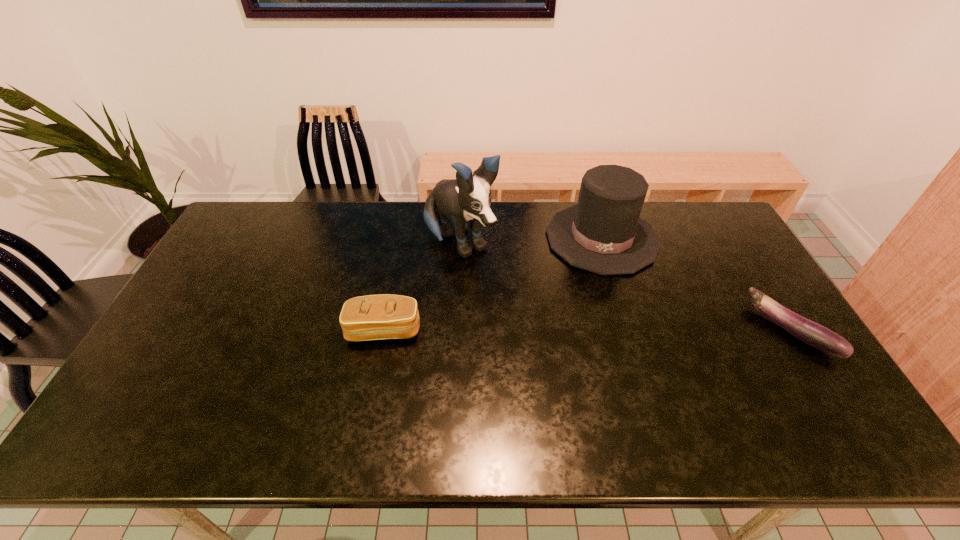
Locate an element on the screen. Image resolution: width=960 pixels, height=540 pixels. free space at the far left corner is located at coordinates (256, 234).

Identify the location of vacant space at the far right corner of the desktop. The width and height of the screenshot is (960, 540). (717, 236).

Where is `free area in between the shortest object and the third tallest object`? free area in between the shortest object and the third tallest object is located at coordinates (588, 330).

This screenshot has height=540, width=960. I want to click on free point between the clutch bag and the shortest object, so click(x=588, y=330).

Where is `free spot between the clutch bag and the rightmost object`? Image resolution: width=960 pixels, height=540 pixels. free spot between the clutch bag and the rightmost object is located at coordinates (588, 330).

Find the location of `free space that is in between the second tallest object and the shortest object`. free space that is in between the second tallest object and the shortest object is located at coordinates (696, 284).

Locate an element on the screen. free point between the tallest object and the dress hat is located at coordinates (531, 241).

The height and width of the screenshot is (540, 960). I want to click on empty location between the dress hat and the second shortest object, so click(x=492, y=284).

Find the location of a particular element. This screenshot has width=960, height=540. free area in between the puppy and the rightmost object is located at coordinates (625, 287).

At what (x,y) coordinates should I click in order to perform the action: click on vacant area that lies between the tallest object and the second object from right to left. Please return your answer as a coordinate pair (x, y). The height and width of the screenshot is (540, 960). Looking at the image, I should click on (531, 241).